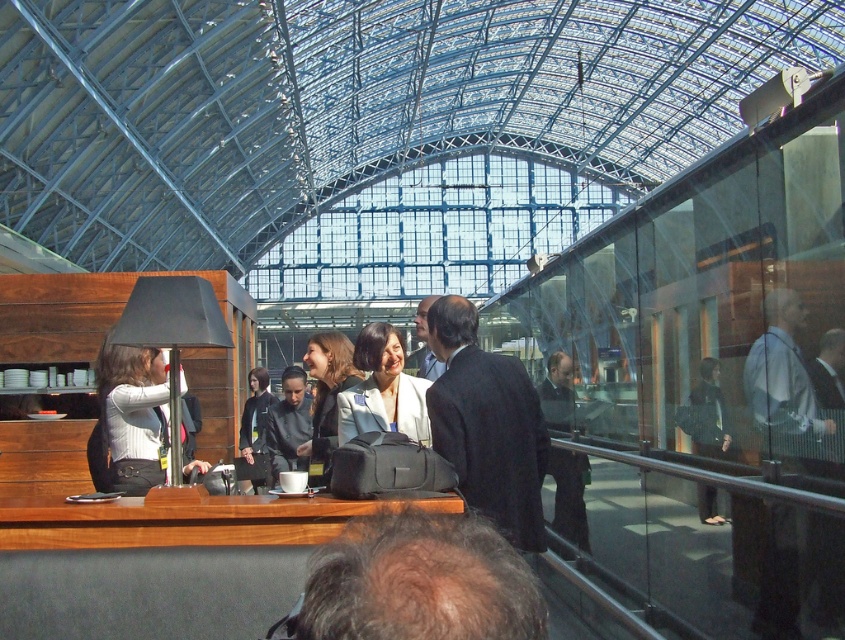
Is light blue shirt at right closer to camera compared to dark blue suit at center?

Yes, light blue shirt at right is in front of dark blue suit at center.

Is point (791, 419) more distant than point (421, 371)?

No, it is not.

What do you see at coordinates (782, 378) in the screenshot? This screenshot has height=640, width=845. I see `light blue shirt at right` at bounding box center [782, 378].

You are a GUI agent. You are given a task and a screenshot of the screen. Output one action in this format:
    pyautogui.click(x=<x>, y=<y>)
    Task: Click on the light blue shirt at right
    The height and width of the screenshot is (640, 845).
    Given the screenshot: What is the action you would take?
    pyautogui.click(x=782, y=378)

Which is behind, point (444, 342) or point (303, 419)?

The point (303, 419) is behind.

Between point (469, 481) and point (292, 385), which one is positioned in front?

Positioned in front is point (469, 481).

Between point (466, 429) and point (289, 378), which one is positioned behind?

The point (289, 378) is more distant.

I want to click on black suit at center, so click(x=488, y=426).

Which is in front, point (772, 305) or point (121, 449)?

Point (772, 305) is in front.

Image resolution: width=845 pixels, height=640 pixels. Describe the element at coordinates (782, 378) in the screenshot. I see `light blue shirt at right` at that location.

What are the coordinates of `light blue shirt at right` in the screenshot? It's located at (782, 378).